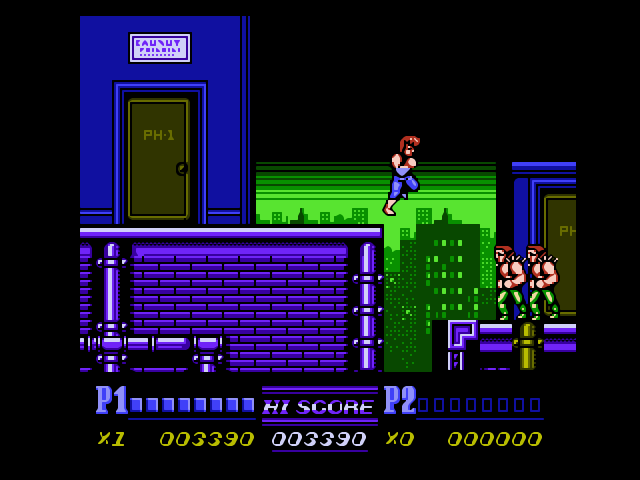
The image size is (640, 480). Identify the location of door. (160, 161).